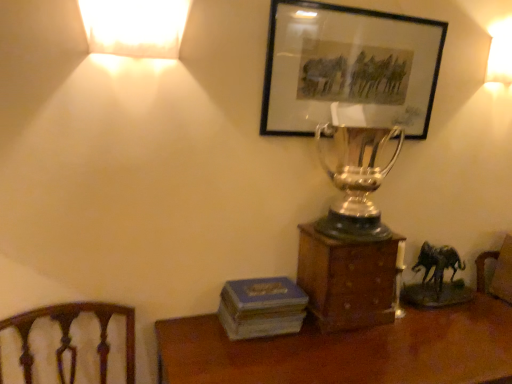
This screenshot has width=512, height=384. What do you see at coordinates (346, 350) in the screenshot?
I see `wooden desk at lower center` at bounding box center [346, 350].

This screenshot has height=384, width=512. I want to click on blue matte book at lower center, so click(261, 307).

Locate an element on the screen. matte white lampshade at upper right, the first lamp in the back-to-front sequence is located at coordinates (500, 52).

What is the approximate height of wooden box at center?

It is 12.96 inches.

Find the location of a particular element. This screenshot has height=384, width=512. matte black picture frame at upper center is located at coordinates (349, 68).

Identify the location of shiny silver trophy at center. The image size is (512, 384). (355, 175).

Locate an element on the screen. wooden desk at lower center is located at coordinates (346, 350).

From a real-world perspective, is blue matte book at lower center under wooden desk at lower center?

No, from a real-world perspective, blue matte book at lower center is not under wooden desk at lower center.

Looking at the image, does blue matte book at lower center seem bigger or smaller compared to wooden desk at lower center?

blue matte book at lower center is smaller than wooden desk at lower center.

Is blue matte book at lower center at the left side of wooden desk at lower center?

Indeed, blue matte book at lower center is positioned on the left side of wooden desk at lower center.

From the image's perspective, which is above, matte white lampshade at upper right, the first lamp positioned from the right, or wooden box at center?

matte white lampshade at upper right, the first lamp positioned from the right.

Considering the positions of point (505, 22) and point (365, 247), is point (505, 22) closer or farther from the camera than point (365, 247)?

Clearly, point (505, 22) is more distant from the camera than point (365, 247).

Is matte white lampshade at upper right, the 2th lamp positioned from the left, positioned with its back to wooden box at center?

No, wooden box at center is not at the back of matte white lampshade at upper right, the 2th lamp positioned from the left.

Considering the relative positions of wooden box at center and matte black picture frame at upper center in the image provided, is wooden box at center to the right of matte black picture frame at upper center from the viewer's perspective?

Incorrect, wooden box at center is not on the right side of matte black picture frame at upper center.

Which of these two, wooden box at center or matte black picture frame at upper center, is thinner?

Thinner between the two is matte black picture frame at upper center.

From the image's perspective, who appears lower, wooden box at center or matte black picture frame at upper center?

Answer: wooden box at center, from the image's perspective.

Is matte black picture frame at upper center aimed at matte white lampshade at upper right, the 2th lamp positioned from the left?

No, matte black picture frame at upper center is not facing towards matte white lampshade at upper right, the 2th lamp positioned from the left.

Between matte black picture frame at upper center and matte white lampshade at upper right, the 2th lamp viewed from the front, which one is positioned behind?

matte white lampshade at upper right, the 2th lamp viewed from the front, is further away from the camera.

How different are the orientations of matte black picture frame at upper center and matte white lampshade at upper right, the 2th lamp viewed from the front, in degrees?

The angle between the facing direction of matte black picture frame at upper center and the facing direction of matte white lampshade at upper right, the 2th lamp viewed from the front, is 1.13 degrees.

Based on the photo, considering the relative sizes of matte black picture frame at upper center and matte white lampshade at upper right, the first lamp in the back-to-front sequence, in the image provided, is matte black picture frame at upper center taller than matte white lampshade at upper right, the first lamp in the back-to-front sequence,?

Yes.

In terms of width, does shiny silver trophy at center look wider or thinner when compared to matte black picture frame at upper center?

Clearly, shiny silver trophy at center has more width compared to matte black picture frame at upper center.

This screenshot has width=512, height=384. I want to click on picture frame on the left of shiny silver trophy at center, so click(x=349, y=68).

Would you say shiny silver trophy at center is inside or outside matte black picture frame at upper center?

shiny silver trophy at center lies outside matte black picture frame at upper center.

Which is closer to the camera, (342, 199) or (410, 24)?

Point (342, 199) appears to be farther away from the viewer than point (410, 24).

How different are the orientations of shiny silver trophy at center and wooden desk at lower center in degrees?

The angular difference between shiny silver trophy at center and wooden desk at lower center is 1.01 degrees.

Is shiny silver trophy at center next to wooden desk at lower center?

No, shiny silver trophy at center is not beside wooden desk at lower center.

Considering the positions of objects shiny silver trophy at center and wooden desk at lower center in the image provided, who is more to the right, shiny silver trophy at center or wooden desk at lower center?

From the viewer's perspective, wooden desk at lower center appears more on the right side.

Considering the relative sizes of shiny silver trophy at center and wooden desk at lower center in the image provided, is shiny silver trophy at center smaller than wooden desk at lower center?

Yes, shiny silver trophy at center is smaller than wooden desk at lower center.

From a real-world perspective, between matte white lampshade at upper right, the first lamp in the back-to-front sequence, and blue matte book at lower center, who is vertically higher?

In real-world perspective, matte white lampshade at upper right, the first lamp in the back-to-front sequence, is above.

Between matte white lampshade at upper right, the 2th lamp viewed from the front, and blue matte book at lower center, which one has more height?

With more height is matte white lampshade at upper right, the 2th lamp viewed from the front.

From the image's perspective, relative to blue matte book at lower center, is matte white lampshade at upper right, the 2th lamp viewed from the front, above or below?

Based on their image positions, matte white lampshade at upper right, the 2th lamp viewed from the front, is located above blue matte book at lower center.

Find the location of `desk lying below the blue matte book at lower center (from the image's perspective)`. desk lying below the blue matte book at lower center (from the image's perspective) is located at coordinates (346, 350).

Where is `furniture on the left of the matte white lampshade at upper right, the 2th lamp viewed from the front`? furniture on the left of the matte white lampshade at upper right, the 2th lamp viewed from the front is located at coordinates (347, 279).

Looking at the image, which one is located closer to wooden box at center, shiny silver trophy at center or matte black picture frame at upper center?

The object closer to wooden box at center is shiny silver trophy at center.

In the scene shown: Which object lies further to the anchor point shiny silver trophy at center, wooden desk at lower center or matte white lampshade at upper right, the 2th lamp viewed from the front?

Based on the image, matte white lampshade at upper right, the 2th lamp viewed from the front, appears to be further to shiny silver trophy at center.

Which object lies nearer to the anchor point matte white lampshade at upper right, the 2th lamp positioned from the left, matte white lampshade at upper left, which is the first lamp from left to right, or wooden desk at lower center?

The object closer to matte white lampshade at upper right, the 2th lamp positioned from the left, is wooden desk at lower center.

Considering their positions, is shiny silver trophy at center positioned closer to matte white lampshade at upper left, which is the first lamp from left to right, than matte white lampshade at upper right, the first lamp positioned from the right?

Among the two, shiny silver trophy at center is located nearer to matte white lampshade at upper left, which is the first lamp from left to right.

Estimate the real-world distances between objects in this image. Which object is closer to matte white lampshade at upper left, the 2th lamp when ordered from right to left, shiny silver trophy at center or wooden box at center?

Among the two, shiny silver trophy at center is located nearer to matte white lampshade at upper left, the 2th lamp when ordered from right to left.

Based on their spatial positions, is wooden desk at lower center or matte black picture frame at upper center closer to wooden box at center?

Among the two, wooden desk at lower center is located nearer to wooden box at center.

Looking at the image, which one is located closer to shiny silver trophy at center, matte black picture frame at upper center or matte white lampshade at upper right, the 2th lamp viewed from the front?

matte black picture frame at upper center is positioned closer to the anchor shiny silver trophy at center.

Estimate the real-world distances between objects in this image. Which object is closer to matte black picture frame at upper center, matte white lampshade at upper right, the first lamp in the back-to-front sequence, or matte white lampshade at upper left, which is the first lamp from left to right?

Based on the image, matte white lampshade at upper left, which is the first lamp from left to right, appears to be nearer to matte black picture frame at upper center.

The height and width of the screenshot is (384, 512). In order to click on furniture between matte black picture frame at upper center and blue matte book at lower center from top to bottom in this screenshot , I will do `click(347, 279)`.

This screenshot has width=512, height=384. Identify the location of paperback book between matte white lampshade at upper left, which is the first lamp from left to right, and wooden desk at lower center in the up-down direction. (261, 307).

Find the location of a particular element. furniture that lies between matte black picture frame at upper center and wooden desk at lower center from top to bottom is located at coordinates (347, 279).

This screenshot has height=384, width=512. I want to click on candle holder that lies between matte black picture frame at upper center and blue matte book at lower center from top to bottom, so click(355, 175).